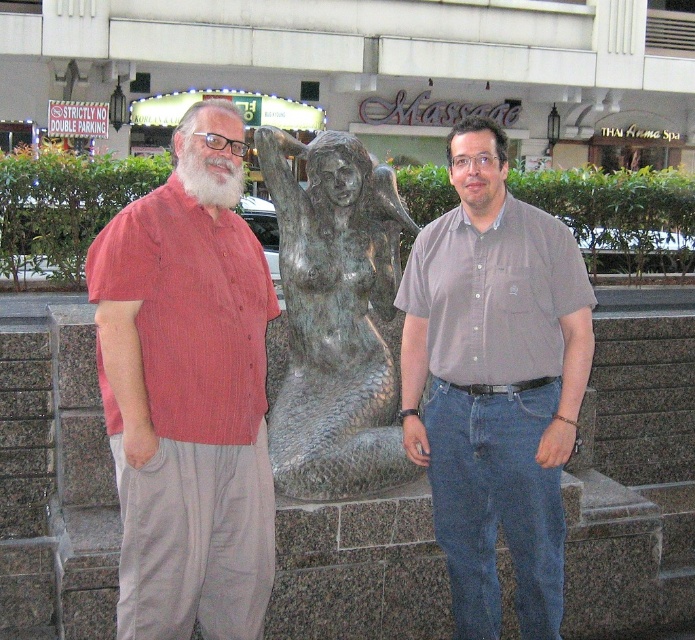
You are an artist observing two people in front of a statue. You notice the white matte beard at left and the white matte beard at center. Which one is bigger?

The white matte beard at left is larger in size compared to the white matte beard at center.

You are a photographer trying to capture a photo of the statue. You notice the red striped shirt at left and the white matte beard at center in the background. Which object should you adjust your camera angle to avoid blocking the statue?

The red striped shirt at left is taller than the white matte beard at center, so you should adjust your camera angle to avoid the red striped shirt at left as it is taller and more likely to block the statue.